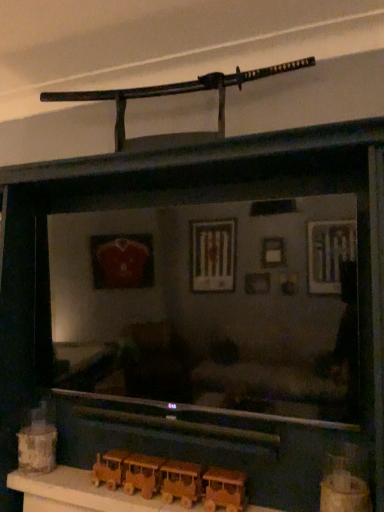
Locate an element on the screen. The width and height of the screenshot is (384, 512). vacant area that lies between wooden train at lower center, which is counted as the 2th toy, starting from the back, and wooden toy train at lower left, the first toy viewed from the left is located at coordinates (75, 482).